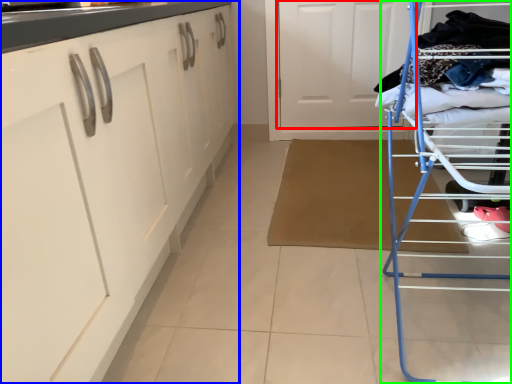
Question: Which is farther away from door (highlighted by a red box)? cabinetry (highlighted by a blue box) or furniture (highlighted by a green box)?

Choices:
 (A) cabinetry
 (B) furniture

Answer: (B)